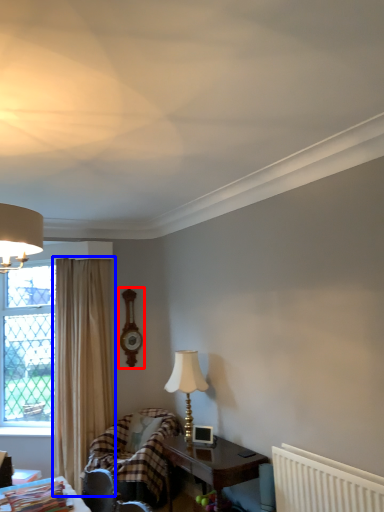
Question: Which object is closer to the camera taking this photo, clock (highlighted by a red box) or curtain (highlighted by a blue box)?

Choices:
 (A) clock
 (B) curtain

Answer: (B)